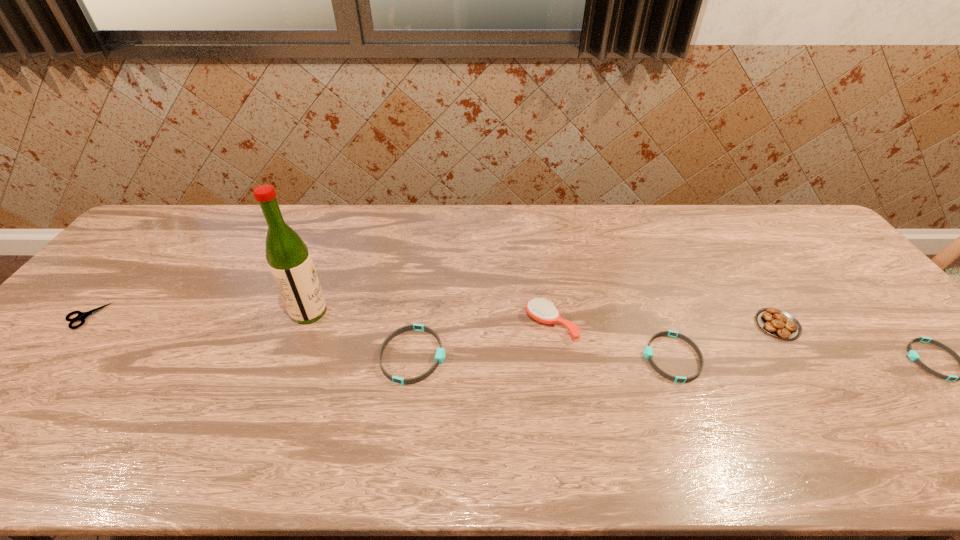
Given the evenly spaced wristbands in the image, where should an extra wristband be added on the left to preserve the spacing? Please point to a vacant space. Please provide its 2D coordinates. Your answer should be formatted as a tuple, i.e. [(x, y)], where the tuple contains the x and y coordinates of a point satisfying the conditions above.

[(157, 353)]